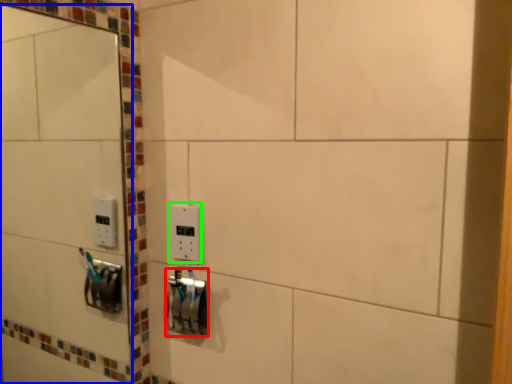
Question: Which is nearer to the lock (highlighted by a red box)? mirror (highlighted by a blue box) or light switch (highlighted by a green box).

Choices:
 (A) mirror
 (B) light switch

Answer: (B)